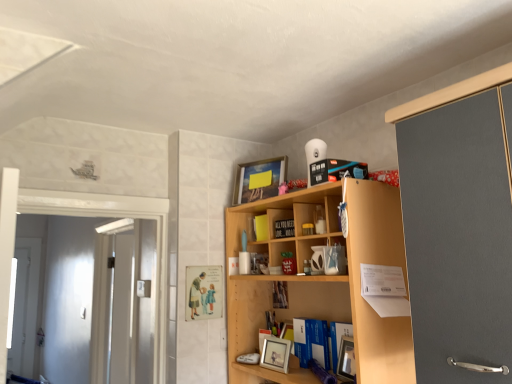
Describe the element at coordinates (284, 228) in the screenshot. I see `matte black book at upper center, arranged as the 1th book when viewed from the top` at that location.

What do you see at coordinates (280, 294) in the screenshot?
I see `wooden photo frame at center, arranged as the first book when ordered from the bottom` at bounding box center [280, 294].

Describe the element at coordinates (261, 227) in the screenshot. This screenshot has height=384, width=512. I see `yellow matte book at upper center, acting as the second book starting from the front` at that location.

The width and height of the screenshot is (512, 384). Identify the location of yellow matte book at upper center, marked as the 2th book in a bottom-to-top arrangement. (261, 227).

What are the coordinates of `matte silver picture frame at center, which ranks as the first picture frame in bottom-to-top order` in the screenshot? It's located at (275, 354).

Where is `the 1st picture frame counting from the left side of the wooden photo frame at center, arranged as the 3th book when viewed from the top`? Image resolution: width=512 pixels, height=384 pixels. the 1st picture frame counting from the left side of the wooden photo frame at center, arranged as the 3th book when viewed from the top is located at coordinates (275, 354).

From a real-world perspective, is matte silver picture frame at center, the 2th picture frame from the back, physically located above or below wooden photo frame at center, arranged as the 3th book when viewed from the top?

matte silver picture frame at center, the 2th picture frame from the back, is situated lower than wooden photo frame at center, arranged as the 3th book when viewed from the top, in the real world.

From the picture: Between matte silver picture frame at center, the 1th picture frame positioned from the front, and wooden photo frame at center, arranged as the first book when ordered from the bottom, which one appears on the left side from the viewer's perspective?

From the viewer's perspective, matte silver picture frame at center, the 1th picture frame positioned from the front, appears more on the left side.

Based on the photo, how many degrees apart are the facing directions of wooden photo frame at center, the first book in the back-to-front sequence, and matte silver picture frame at center, which ranks as the first picture frame in bottom-to-top order?

The facing directions of wooden photo frame at center, the first book in the back-to-front sequence, and matte silver picture frame at center, which ranks as the first picture frame in bottom-to-top order, are 8.05 degrees apart.

Is wooden photo frame at center, the first book in the back-to-front sequence, aimed at matte silver picture frame at center, the 1th picture frame positioned from the front?

No, wooden photo frame at center, the first book in the back-to-front sequence, is not aimed at matte silver picture frame at center, the 1th picture frame positioned from the front.

Would you say wooden photo frame at center, arranged as the first book when ordered from the bottom, is inside or outside matte silver picture frame at center, the 2th picture frame from the back?

wooden photo frame at center, arranged as the first book when ordered from the bottom, is spatially situated outside matte silver picture frame at center, the 2th picture frame from the back.

The image size is (512, 384). There is a matte silver picture frame at center, the 2th picture frame from the back. What are the coordinates of `the 1st book above it (from the image's perspective)` in the screenshot? It's located at (280, 294).

Considering the positions of objects matte wooden picture frame at upper center, which ranks as the second picture frame in front-to-back order, and wooden photo frame at center, arranged as the first book when ordered from the bottom, in the image provided, who is more to the right, matte wooden picture frame at upper center, which ranks as the second picture frame in front-to-back order, or wooden photo frame at center, arranged as the first book when ordered from the bottom,?

From the viewer's perspective, wooden photo frame at center, arranged as the first book when ordered from the bottom, appears more on the right side.

Would you say matte wooden picture frame at upper center, which ranks as the second picture frame in front-to-back order, is outside wooden photo frame at center, arranged as the 3th book when viewed from the top?

That's correct, matte wooden picture frame at upper center, which ranks as the second picture frame in front-to-back order, is outside of wooden photo frame at center, arranged as the 3th book when viewed from the top.

Considering the relative sizes of matte wooden picture frame at upper center, which appears as the 1th picture frame when viewed from the back, and wooden photo frame at center, arranged as the first book when ordered from the bottom, in the image provided, is matte wooden picture frame at upper center, which appears as the 1th picture frame when viewed from the back, bigger than wooden photo frame at center, arranged as the first book when ordered from the bottom,?

Indeed, matte wooden picture frame at upper center, which appears as the 1th picture frame when viewed from the back, has a larger size compared to wooden photo frame at center, arranged as the first book when ordered from the bottom.

Are matte silver picture frame at center, which ranks as the first picture frame in bottom-to-top order, and white glossy door at left located far from each other?

Yes, matte silver picture frame at center, which ranks as the first picture frame in bottom-to-top order, is far from white glossy door at left.

Is matte silver picture frame at center, the 1th picture frame positioned from the front, situated inside white glossy door at left or outside?

matte silver picture frame at center, the 1th picture frame positioned from the front, is located beyond the bounds of white glossy door at left.

Does matte silver picture frame at center, the 1th picture frame positioned from the front, turn towards white glossy door at left?

No, matte silver picture frame at center, the 1th picture frame positioned from the front, does not turn towards white glossy door at left.

How far apart are matte silver picture frame at center, which ranks as the first picture frame in bottom-to-top order, and white glossy door at left?

The distance of matte silver picture frame at center, which ranks as the first picture frame in bottom-to-top order, from white glossy door at left is 3.46 feet.

Is wooden shelf at center inside matte black book at upper center, arranged as the 1th book when viewed from the top?

Definitely not — wooden shelf at center is not inside matte black book at upper center, arranged as the 1th book when viewed from the top.

How much distance is there between matte black book at upper center, arranged as the first book when viewed from the front, and wooden shelf at center?

They are 36.71 centimeters apart.

Is matte black book at upper center, the 3th book when ordered from bottom to top, smaller than wooden shelf at center?

Correct, matte black book at upper center, the 3th book when ordered from bottom to top, occupies less space than wooden shelf at center.

Which object is further away from the camera, matte black book at upper center, arranged as the first book when viewed from the front, or wooden shelf at center?

matte black book at upper center, arranged as the first book when viewed from the front, is behind.

From a real-world perspective, is wooden shelf at center above or below matte black book at upper center, arranged as the 1th book when viewed from the top?

From a real-world perspective, wooden shelf at center is physically below matte black book at upper center, arranged as the 1th book when viewed from the top.

Which is nearer, [408,363] or [275,221]?

Point [408,363] is closer to the camera than point [275,221].

Is wooden shelf at center oriented towards matte black book at upper center, arranged as the 1th book when viewed from the top?

Yes.

Find the location of a particular element. The image size is (512, 384). shelf below the matte black book at upper center, arranged as the first book when viewed from the front (from the image's perspective) is located at coordinates (323, 279).

Where is `picture frame above the matte silver picture frame at center, the 2th picture frame from the back (from a real-world perspective)`? picture frame above the matte silver picture frame at center, the 2th picture frame from the back (from a real-world perspective) is located at coordinates (259, 179).

Are matte silver picture frame at center, placed as the 2th picture frame when sorted from top to bottom, and matte wooden picture frame at upper center, which appears as the second picture frame when ordered from the bottom, making contact?

matte silver picture frame at center, placed as the 2th picture frame when sorted from top to bottom, and matte wooden picture frame at upper center, which appears as the second picture frame when ordered from the bottom, are not in contact.

Looking at this image, which of these two, matte silver picture frame at center, which ranks as the first picture frame in bottom-to-top order, or matte wooden picture frame at upper center, which is the first picture frame from top to bottom, stands shorter?

With less height is matte silver picture frame at center, which ranks as the first picture frame in bottom-to-top order.

From a real-world perspective, is matte silver picture frame at center, placed as the 2th picture frame when sorted from top to bottom, physically located above or below matte wooden picture frame at upper center, which ranks as the second picture frame in front-to-back order?

matte silver picture frame at center, placed as the 2th picture frame when sorted from top to bottom, is below matte wooden picture frame at upper center, which ranks as the second picture frame in front-to-back order.

From a real-world perspective, count 1st books upward from the matte silver picture frame at center, the 1th picture frame positioned from the front, and point to it. Please provide its 2D coordinates.

[(280, 294)]

Identify the location of the 2nd picture frame in front of the wooden photo frame at center, the third book positioned from the front, counting from the anchor's position. (275, 354).

From the image, which object appears to be nearer to matte silver picture frame at center, placed as the 2th picture frame when sorted from top to bottom, wooden photo frame at center, arranged as the 3th book when viewed from the top, or matte wooden picture frame at upper center, which is the first picture frame from top to bottom?

wooden photo frame at center, arranged as the 3th book when viewed from the top, is positioned closer to the anchor matte silver picture frame at center, placed as the 2th picture frame when sorted from top to bottom.

Estimate the real-world distances between objects in this image. Which object is closer to matte silver picture frame at center, the 1th picture frame positioned from the front, wooden shelf at center or yellow matte book at upper center, acting as the second book starting from the front?

The object closer to matte silver picture frame at center, the 1th picture frame positioned from the front, is wooden shelf at center.

Consider the image. From the image, which object appears to be farther from matte wooden picture frame at upper center, which appears as the 1th picture frame when viewed from the back, wooden photo frame at center, the third book positioned from the front, or wooden shelf at center?

Based on the image, wooden photo frame at center, the third book positioned from the front, appears to be further to matte wooden picture frame at upper center, which appears as the 1th picture frame when viewed from the back.

When comparing their distances from wooden photo frame at center, arranged as the 3th book when viewed from the top, does yellow matte book at upper center, which is counted as the second book, starting from the top, or wooden shelf at center seem further?

Among the two, wooden shelf at center is located further to wooden photo frame at center, arranged as the 3th book when viewed from the top.

Which object lies nearer to the anchor point wooden photo frame at center, the third book positioned from the front, matte silver picture frame at center, the 2th picture frame from the back, or wooden shelf at center?

matte silver picture frame at center, the 2th picture frame from the back, is closer to wooden photo frame at center, the third book positioned from the front.

Estimate the real-world distances between objects in this image. Which object is closer to white glossy door at left, wooden shelf at center or wooden photo frame at center, the third book positioned from the front?

The object closer to white glossy door at left is wooden shelf at center.

Looking at the image, which one is located further to matte black book at upper center, the 3th book when ordered from bottom to top, matte wooden picture frame at upper center, which appears as the 1th picture frame when viewed from the back, or white glossy door at left?

Based on the image, white glossy door at left appears to be further to matte black book at upper center, the 3th book when ordered from bottom to top.

When comparing their distances from matte wooden picture frame at upper center, which appears as the second picture frame when ordered from the bottom, does matte black book at upper center, placed as the third book when sorted from back to front, or white glossy door at left seem further?

The object further to matte wooden picture frame at upper center, which appears as the second picture frame when ordered from the bottom, is white glossy door at left.

At what (x,y) coordinates should I click in order to perform the action: click on book between wooden shelf at center and yellow matte book at upper center, acting as the second book starting from the back, from front to back. Please return your answer as a coordinate pair (x, y). The width and height of the screenshot is (512, 384). Looking at the image, I should click on (284, 228).

The width and height of the screenshot is (512, 384). What are the coordinates of `book between wooden shelf at center and matte wooden picture frame at upper center, which ranks as the second picture frame in front-to-back order, from front to back` in the screenshot? It's located at (284, 228).

Locate an element on the screen. book that lies between matte wooden picture frame at upper center, which appears as the second picture frame when ordered from the bottom, and yellow matte book at upper center, marked as the 2th book in a bottom-to-top arrangement, from top to bottom is located at coordinates (284, 228).

The image size is (512, 384). Find the location of `book between white glossy door at left and wooden photo frame at center, the third book positioned from the front, in the horizontal direction`. book between white glossy door at left and wooden photo frame at center, the third book positioned from the front, in the horizontal direction is located at coordinates (261, 227).